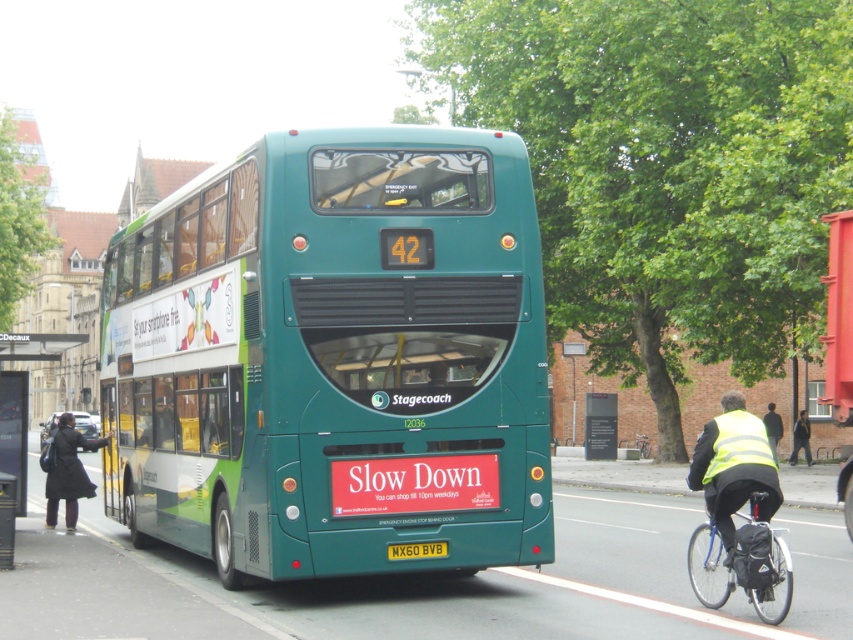
You are a pedestrian standing at the bus stop shelter to the left of the green matte bus at center. You want to cross the street to reach the blue metallic bicycle at lower right. Which direction should you walk to get there?

Since the green matte bus at center is to the left of the blue metallic bicycle at lower right, you should walk to the right from the bus stop shelter to reach the blue metallic bicycle at lower right.

You are a pedestrian standing at the bus stop. You notice a high visibility yellow vest at lower right and a black plastic bus stop at lower left. Which object is closer to you?

The high visibility yellow vest at lower right is in front of the black plastic bus stop at lower left, so it is closer to you.

You are standing at the bus stop shelter to the left of the Stagecoach bus. You see two points marked on the bus, one at coordinate point (767, 461) and another at point (1, 532). Which point is closer to you?

Point (767, 461) is closer to you because it is closer to the camera than point (1, 532).